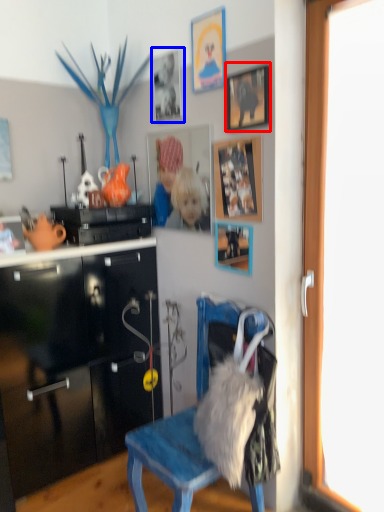
Question: Which object appears closest to the camera in this image, picture frame (highlighted by a red box) or picture frame (highlighted by a blue box)?

Choices:
 (A) picture frame
 (B) picture frame

Answer: (A)